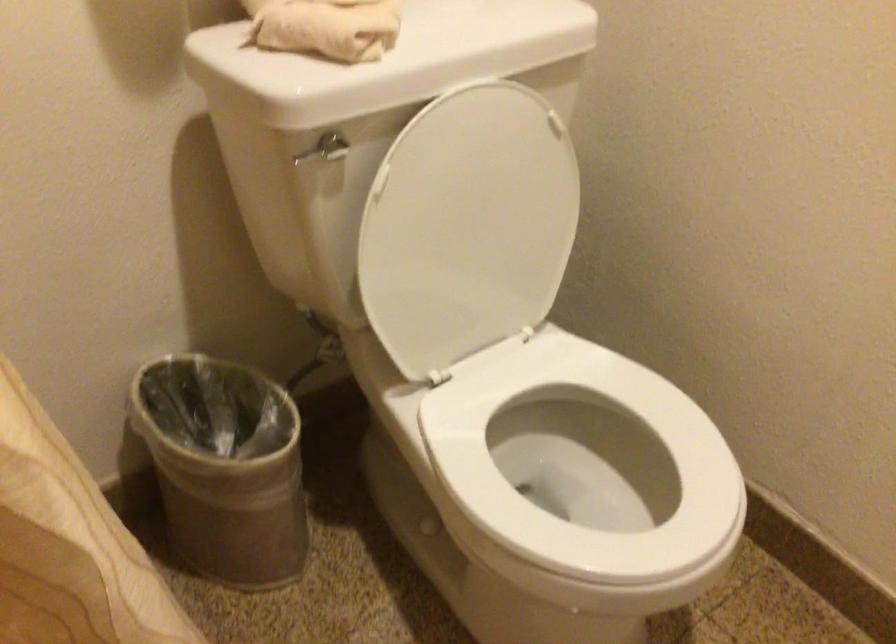
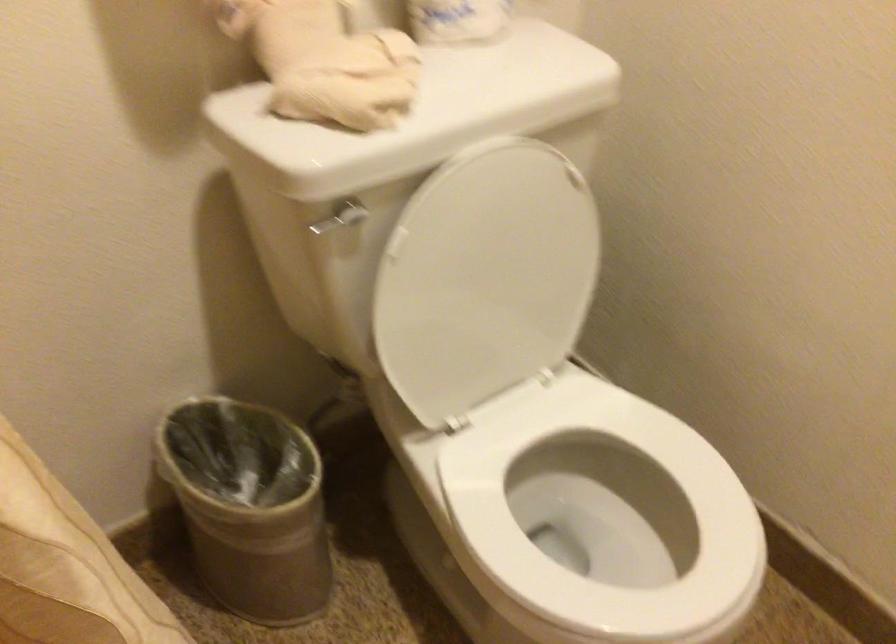
Question: Which direction would the cameraman need to move to produce the second image? Reply with the corresponding letter.

Choices:
 (A) Left
 (B) Right
 (C) Forward
 (D) Backward

Answer: (B)